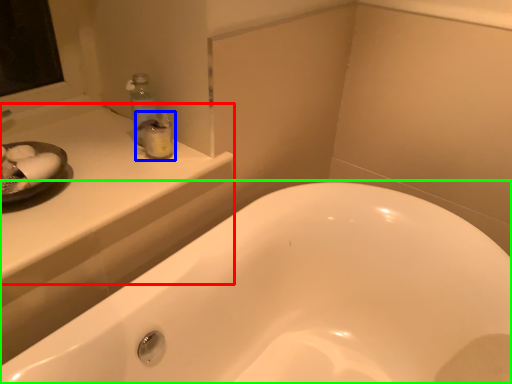
Question: Based on their relative distances, which object is farther from counter top (highlighted by a red box)? Choose from toiletry (highlighted by a blue box) and bathtub (highlighted by a green box).

Choices:
 (A) toiletry
 (B) bathtub

Answer: (B)